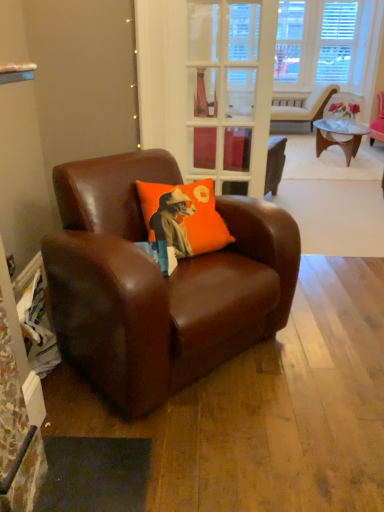
Question: Is point (226, 227) positioned closer to the camera than point (311, 121)?

Choices:
 (A) farther
 (B) closer

Answer: (B)

Question: From the image's perspective, relative to matte brown armchair at upper right, which is counted as the first chair, starting from the right, is orange fabric pillow at center above or below?

Choices:
 (A) below
 (B) above

Answer: (A)

Question: Which is nearer to the orange fabric pillow at center?

Choices:
 (A) brown leather chair at left, marked as the 2th chair in a back-to-front arrangement
 (B) clear glass door at center
 (C) matte brown armchair at upper right, which appears as the first chair when viewed from the back

Answer: (A)

Question: Which object is positioned farthest from the brown leather chair at left, which is the second chair from right to left?

Choices:
 (A) matte brown armchair at upper right, which is counted as the first chair, starting from the right
 (B) clear glass door at center
 (C) orange fabric pillow at center

Answer: (A)